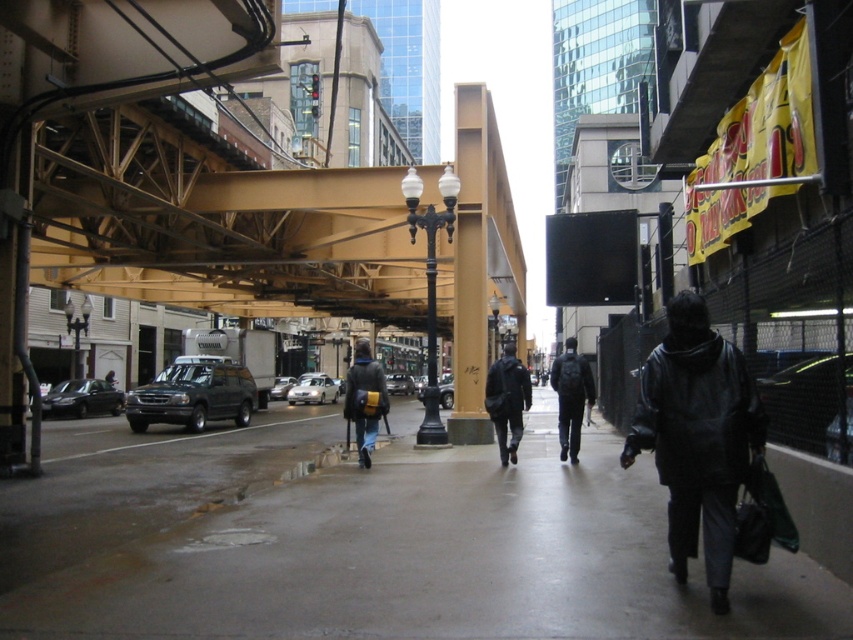
Question: Does concrete sidewalk at center appear on the left side of matte black suv at left?

Choices:
 (A) no
 (B) yes

Answer: (A)

Question: Estimate the real-world distances between objects in this image. Which object is closer to the silver metallic suv at center?

Choices:
 (A) matte black suv at center
 (B) black glossy car at lower right

Answer: (A)

Question: Estimate the real-world distances between objects in this image. Which object is closer to the silver metallic sedan at center?

Choices:
 (A) dark gray backpack at center
 (B) black glossy car at lower right

Answer: (A)

Question: Based on their relative distances, which object is farther from the dark gray jacket at center?

Choices:
 (A) black glossy car at lower right
 (B) matte black suv at left

Answer: (B)

Question: Does silver metallic sedan at center appear under silver metallic suv at center?

Choices:
 (A) no
 (B) yes

Answer: (A)

Question: Is brown wood pillar at center in front of black glossy car at lower right?

Choices:
 (A) no
 (B) yes

Answer: (A)